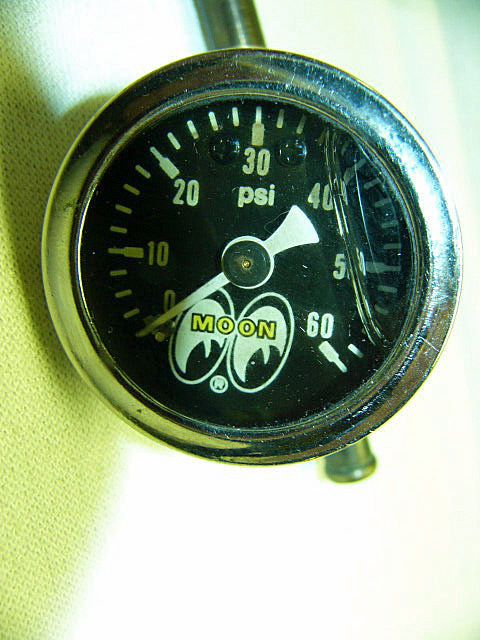
This screenshot has width=480, height=640. I want to click on screws, so click(x=287, y=152), click(x=228, y=144).